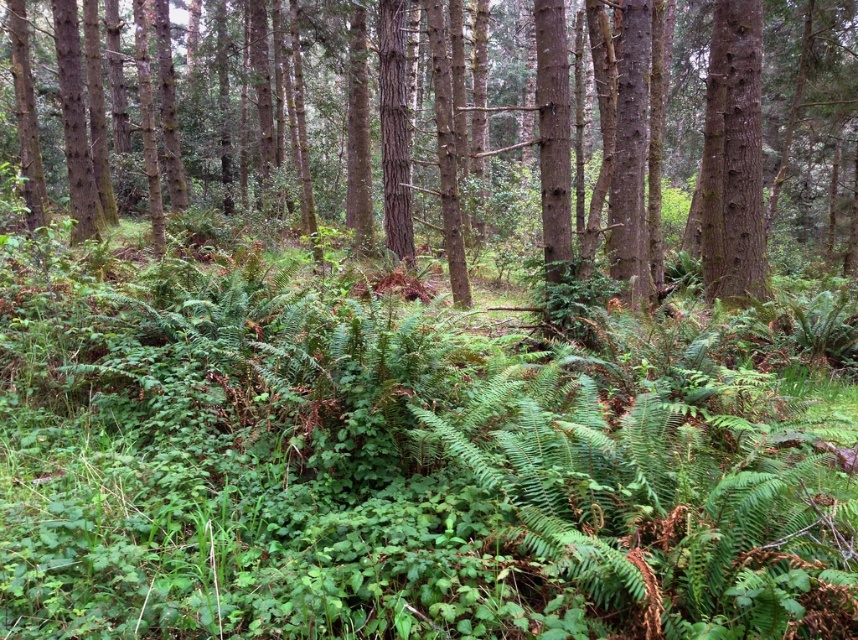
You are navigating through the dense forest depicted in the image. You have to move from your current position to a destination point. There are two landmarks marked as point coordinates in the scene. Which point should you head towards first if you want to reach your destination more quickly? Please choose between point (713, 276) and point (750, 45).

You should head towards point (750, 45) first because point (713, 276) is behind point (750, 45), meaning point (750, 45) is closer to your current position.

Consider the image. You are a hiker in the forest and want to find the tallest tree to take a photo. Which tree should you choose between the smooth bark tree at center and the smooth brown tree trunk at upper right?

The smooth bark tree at center is much taller than the smooth brown tree trunk at upper right, so you should choose the smooth bark tree at center for your photo.